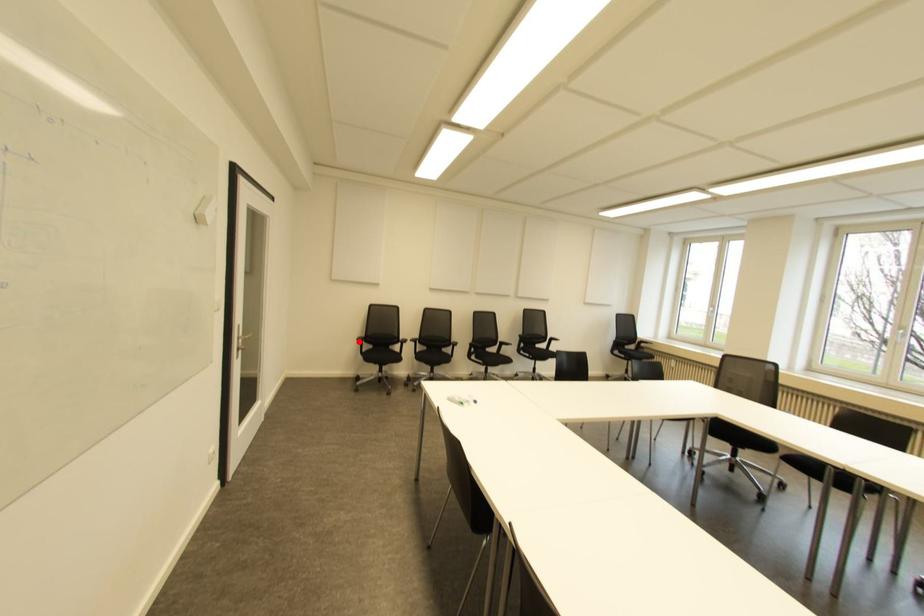
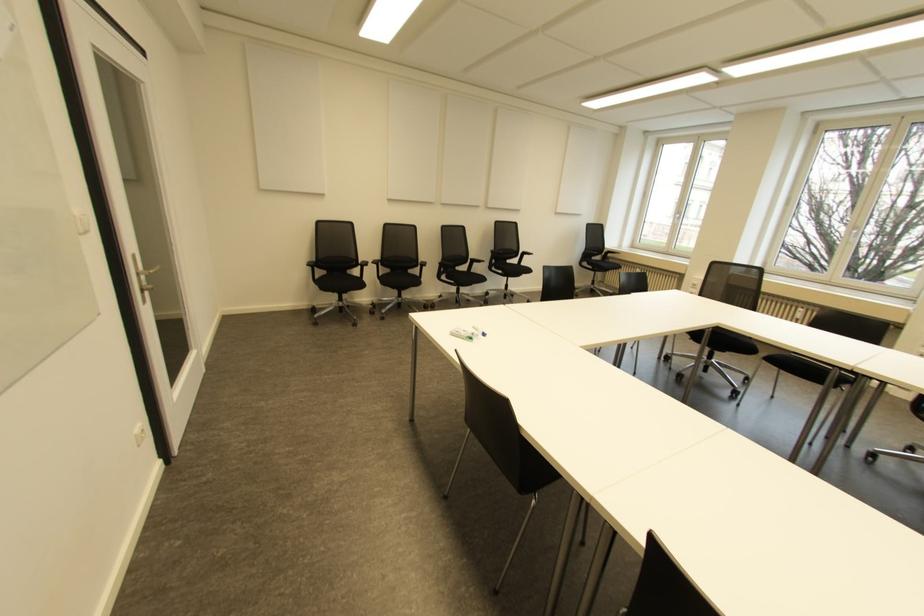
Question: I am providing you with two images of the same scene from different viewpoints. In image1, a red point is highlighted. Considering the same 3D point in image2, which of the following is correct?

Choices:
 (A) It is closer
 (B) It is farther

Answer: (A)